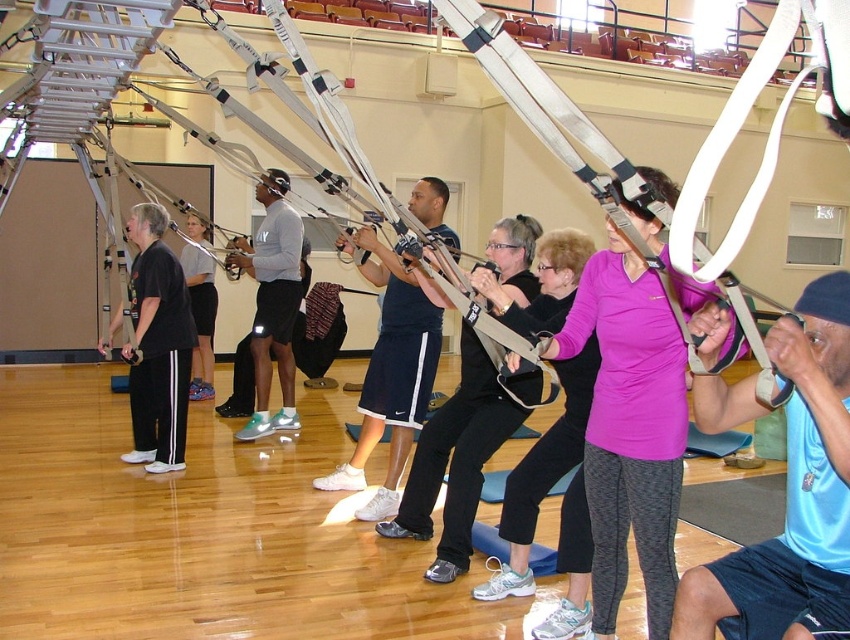
Question: Observing the image, what is the correct spatial positioning of black matte/black pants at left in reference to matte black shorts at center?

Choices:
 (A) below
 (B) above

Answer: (A)

Question: Which point is farther from the camera taking this photo?

Choices:
 (A) (204, 312)
 (B) (143, 308)

Answer: (A)

Question: Which object appears farthest from the camera in this image?

Choices:
 (A) pink matte shirt at center
 (B) matte pink shirt at center
 (C) black matte/black pants at left
 (D) matte black shorts at center

Answer: (D)

Question: Which point is farther to the camera?

Choices:
 (A) matte black shorts at center
 (B) matte pink shirt at center
 (C) black matte/black pants at left
 (D) pink matte shirt at center

Answer: (A)

Question: Does pink matte shirt at center appear over black matte/black pants at left?

Choices:
 (A) no
 (B) yes

Answer: (A)

Question: Does matte pink shirt at center have a lesser width compared to matte black shorts at center?

Choices:
 (A) yes
 (B) no

Answer: (A)